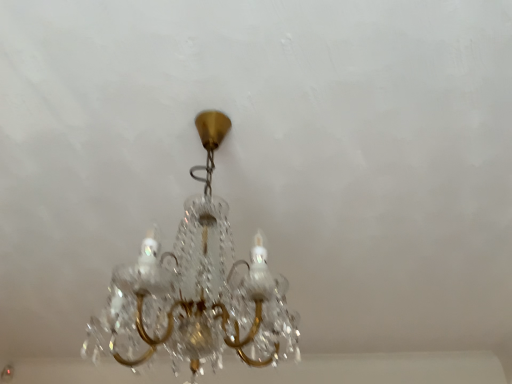
Question: Should I look upward or downward to see clear crystal chandelier at center?

Choices:
 (A) down
 (B) up

Answer: (A)